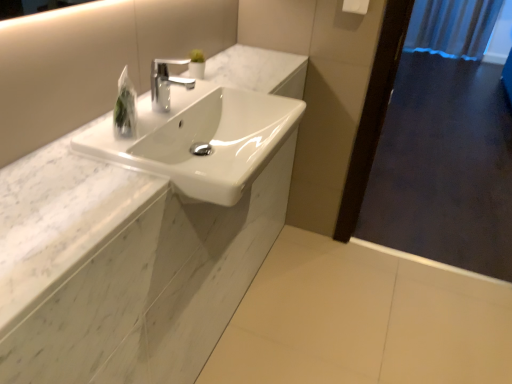
Question: From the image's perspective, relative to white glossy sink at center, is white marble counter at center above or below?

Choices:
 (A) above
 (B) below

Answer: (A)

Question: Is white marble counter at center to the left or to the right of white glossy sink at center in the image?

Choices:
 (A) left
 (B) right

Answer: (A)

Question: Which of these objects is positioned closest to the white marble counter at center?

Choices:
 (A) white glossy sink at center
 (B) polished chrome faucet at center
 (C) blue fabric shower curtain at upper right
 (D) clear plastic bag at upper center
 (E) dark wood screen door at right

Answer: (A)

Question: Which is nearer to the white marble counter at center?

Choices:
 (A) polished chrome faucet at center
 (B) blue fabric shower curtain at upper right
 (C) white glossy sink at center
 (D) clear plastic bag at upper center
 (E) white plastic towel bar at upper right

Answer: (C)